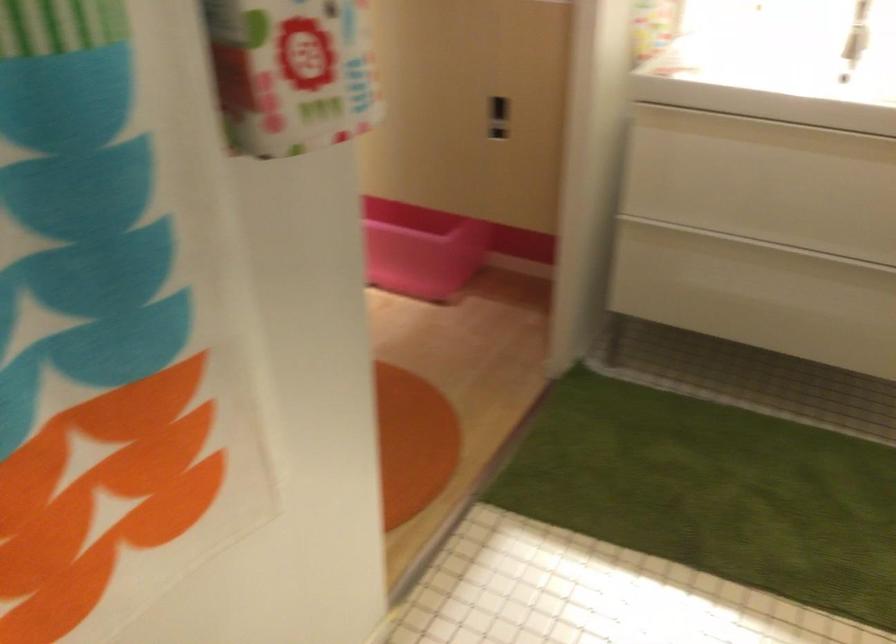
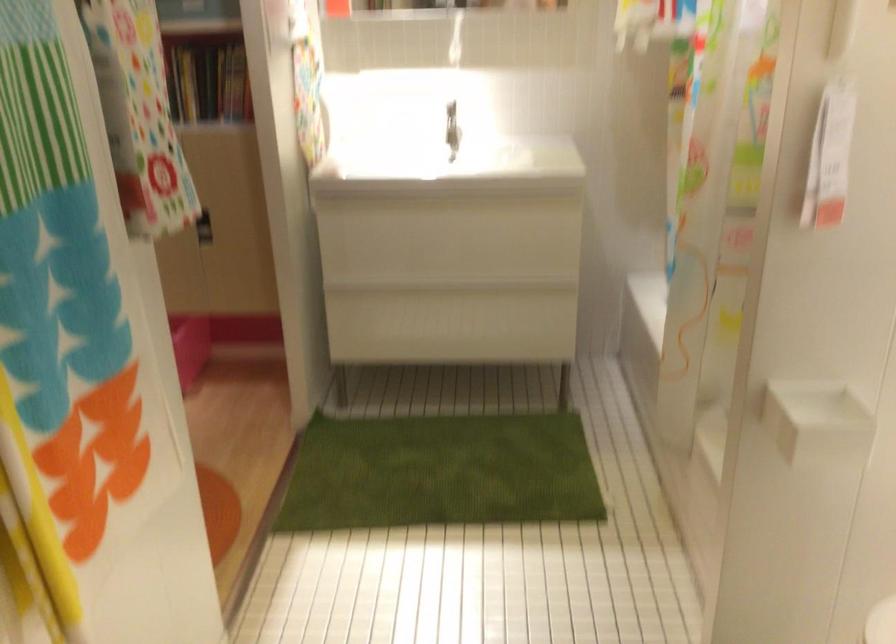
The point at (814, 124) is marked in the first image. Where is the corresponding point in the second image?

(440, 201)